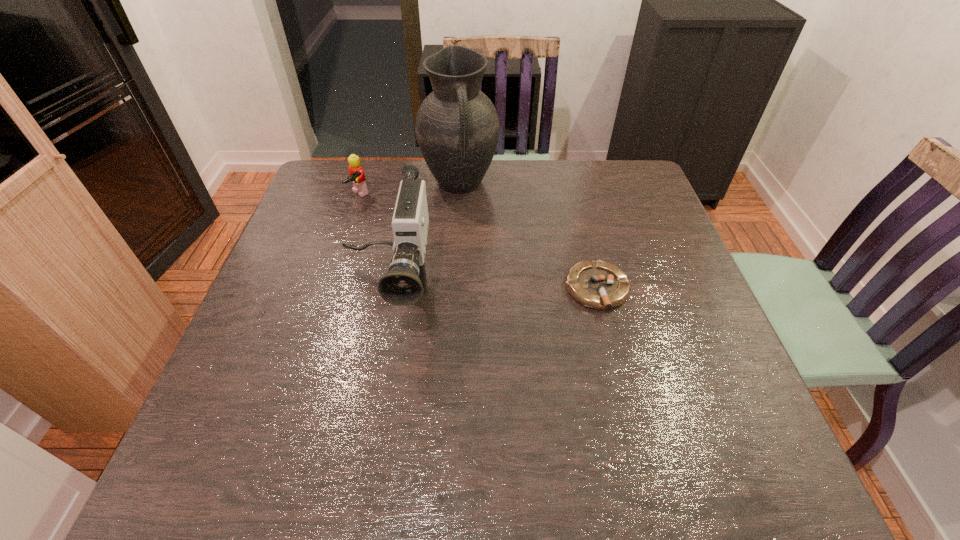
I want to click on vacant space at the left edge of the desktop, so 309,222.

Find the location of a particular element. The height and width of the screenshot is (540, 960). vacant space at the right edge of the desktop is located at coordinates (636, 251).

Locate an element on the screen. The width and height of the screenshot is (960, 540). free space at the far left corner of the desktop is located at coordinates (340, 179).

Where is `blank space at the near left corner of the desktop`? Image resolution: width=960 pixels, height=540 pixels. blank space at the near left corner of the desktop is located at coordinates (238, 397).

Image resolution: width=960 pixels, height=540 pixels. I want to click on vacant region at the far right corner of the desktop, so click(x=605, y=162).

Find the location of `vacant space at the near right corner of the desktop`. vacant space at the near right corner of the desktop is located at coordinates (700, 394).

You are a GUI agent. You are given a task and a screenshot of the screen. Output one action in this format:
    pyautogui.click(x=<x>, y=<y>)
    Task: Click on the free point between the second tallest object and the shortest object
    
    Given the screenshot: What is the action you would take?
    pyautogui.click(x=492, y=289)

At what (x,y) coordinates should I click in order to perform the action: click on empty space that is in between the camcorder and the rightmost object. Please return your answer as a coordinate pair (x, y). Looking at the image, I should click on (492, 289).

Identify the location of free area in between the camcorder and the shortest object. The width and height of the screenshot is (960, 540). pyautogui.click(x=492, y=289).

This screenshot has width=960, height=540. Identify the location of free space that is in between the shortest object and the pitcher. (528, 237).